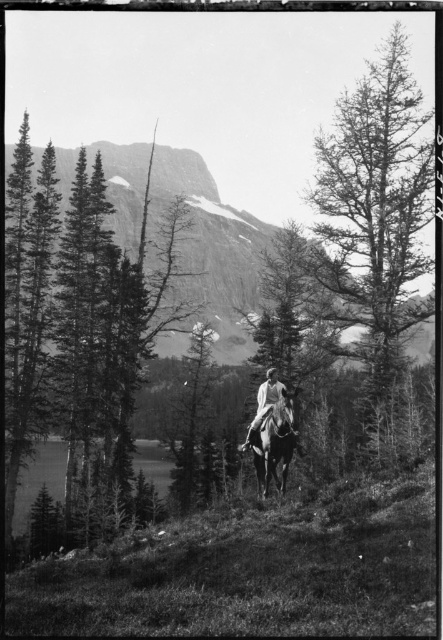
Is smooth bark tree at center wider than white clothed figure at center?

Indeed, smooth bark tree at center has a greater width compared to white clothed figure at center.

In the scene shown: How distant is smooth bark tree at center from white clothed figure at center?

The distance of smooth bark tree at center from white clothed figure at center is 94.48 feet.

Is point (346, 122) positioned in front of point (260, 410)?

No, (346, 122) is further to viewer.

You are a GUI agent. You are given a task and a screenshot of the screen. Output one action in this format:
    pyautogui.click(x=<x>, y=<y>)
    Task: Click on the smooth bark tree at center
    The height and width of the screenshot is (640, 443).
    Given the screenshot: What is the action you would take?
    [376, 224]

Is rugged stone mountain at upper center taller than white clothed figure at center?

Correct, rugged stone mountain at upper center is much taller as white clothed figure at center.

Is rugged stone mountain at upper center in front of white clothed figure at center?

No.

Does point (213, 259) come in front of point (275, 385)?

No, (213, 259) is further to viewer.

Where is `rugged stone mountain at upper center`? The height and width of the screenshot is (640, 443). rugged stone mountain at upper center is located at coordinates (213, 248).

Measure the distance from smooth bark tree at center to white glossy horse at center.

They are 37.28 meters apart.

Is smooth bark tree at center below white glossy horse at center?

Incorrect, smooth bark tree at center is not positioned below white glossy horse at center.

Which is in front, point (337, 224) or point (284, 413)?

Point (284, 413) is in front.

Find the location of `smooth bark tree at center`. smooth bark tree at center is located at coordinates pos(376,224).